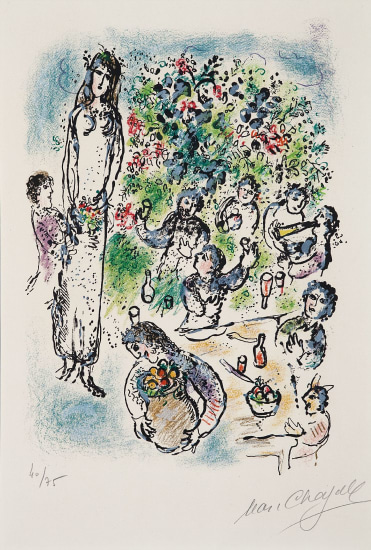
At what (x,y) coordinates should I click in order to perform the action: click on bowl of fruit on artwork. Please return your answer as a coordinate pair (x, y). The image size is (371, 550). Looking at the image, I should click on (262, 399).